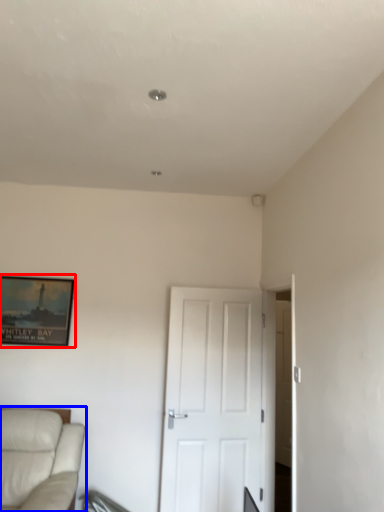
Question: Which object appears farthest to the camera in this image, picture frame (highlighted by a red box) or studio couch (highlighted by a blue box)?

Choices:
 (A) picture frame
 (B) studio couch

Answer: (A)